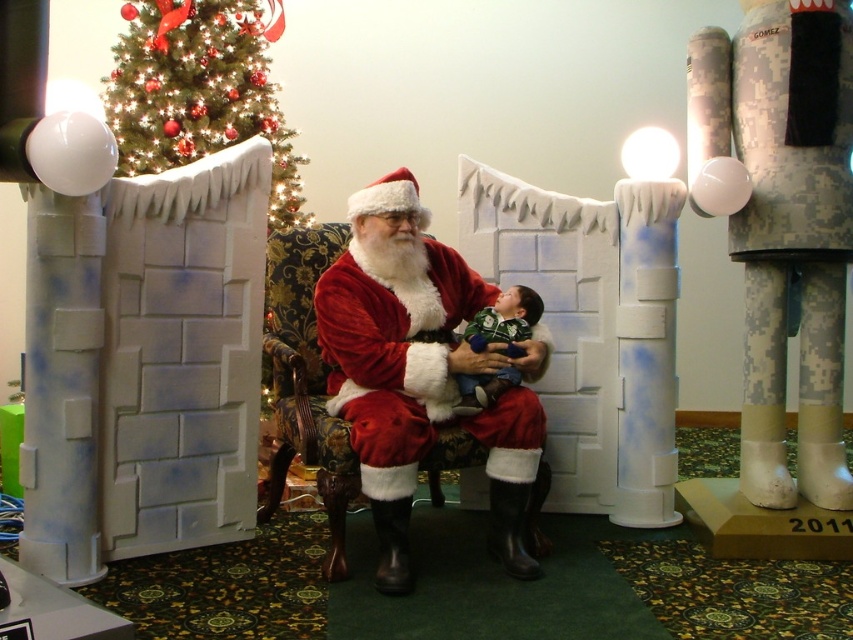
You are standing in the festive indoor setting and want to move from the green fuzzy sweater at center to the green matte christmas tree at upper left. Which direction should you move to reach it?

You should move to the left to reach the green matte christmas tree at upper left since it is located to the left of the green fuzzy sweater at center.

You are planning to take a photo of the velvet red santa at center and the green matte christmas tree at upper left. Which object is wider?

The velvet red santa at center is less wide than the green matte christmas tree at upper left, so the green matte christmas tree at upper left is wider.

You are a photographer setting up for a holiday photo shoot. You need to ensure that the velvet red santa at center and the green matte christmas tree at upper left are both visible in the frame. Given their sizes, which object will appear larger in the photo?

The velvet red santa at center will appear larger in the photo because it is taller than the green matte christmas tree at upper left.